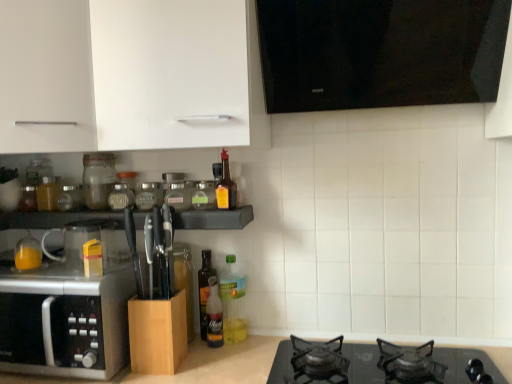
At what (x,y) coordinates should I click in order to perform the action: click on vacant space in front of translucent glass bottle at left, marked as the 2th bottle in a left-to-right arrangement. Please return your answer as a coordinate pair (x, y). This screenshot has width=512, height=384. Looking at the image, I should click on (21, 278).